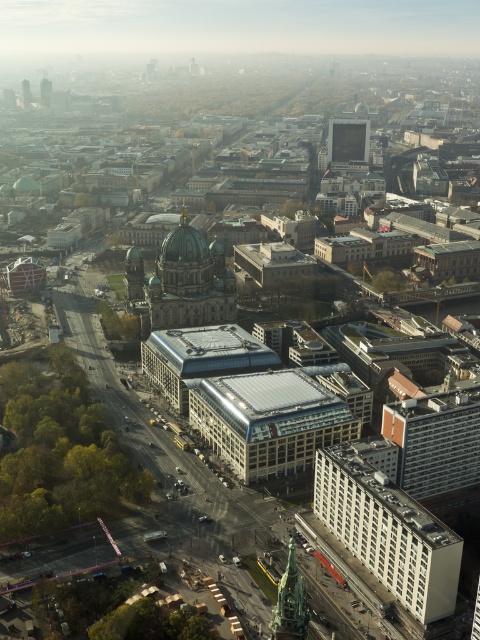
Question: Where is orange brick building at lower right located in relation to gold domed tower at center in the image?

Choices:
 (A) below
 (B) above

Answer: (A)

Question: Which point appears closest to the camera in this image?

Choices:
 (A) [x=197, y=300]
 (B) [x=354, y=145]

Answer: (A)

Question: Which point is closer to the camera?

Choices:
 (A) (46, 92)
 (B) (24, 90)
 (C) (289, 552)
 (D) (410, 484)

Answer: (C)

Question: Is white concrete building at lower right wider than gold domed tower at center?

Choices:
 (A) yes
 (B) no

Answer: (B)

Question: Which of the following is the closest to the observer?

Choices:
 (A) gold domed tower at center
 (B) bronze statue at lower center
 (C) green glass tower at upper left

Answer: (B)

Question: Can you confirm if gold domed tower at center is positioned to the left of bronze statue at lower center?

Choices:
 (A) no
 (B) yes

Answer: (B)